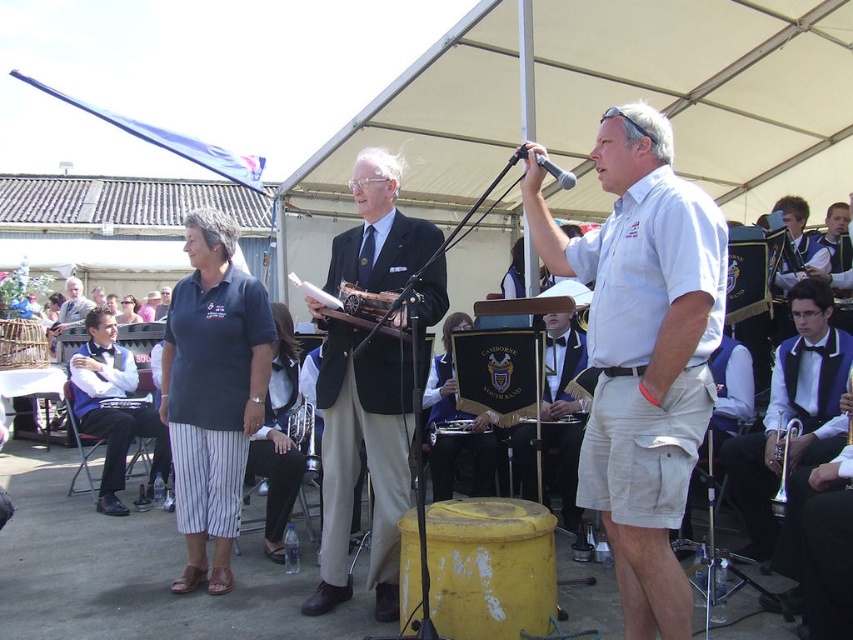
You are organizing a community event and need to ensure that the matte black suit at center and the wooden microphone at center can fit on a shelf that is 1.2 meters wide. Based on their sizes, will both items fit comfortably on the shelf together?

The matte black suit at center is larger than the wooden microphone at center. However, since the shelf is 1.2 meters wide, both items should fit comfortably as long as their combined size does not exceed the shelf width. Without exact measurements, it is advisable to check the dimensions of both items to ensure they fit within the available space.

You are organizing a parade route and need to place a 15 feet long banner between the matte black vest at left and the brass bell at center. Will the banner fit without overlapping either object?

The distance between the matte black vest at left and the brass bell at center is 16.03 feet. Since the banner is 15 feet long, it will fit between them without overlapping as there is an extra 1.03 feet of space.